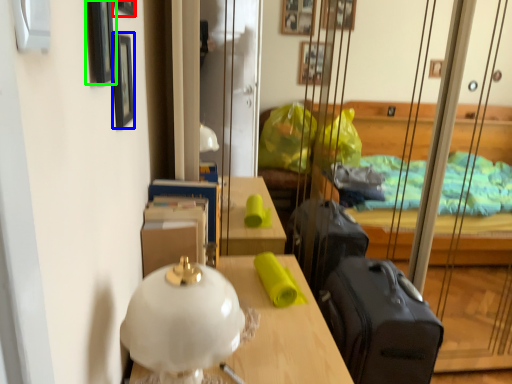
Question: Which object is positioned farthest from picture frame (highlighted by a red box)? Select from picture frame (highlighted by a blue box) and picture frame (highlighted by a green box).

Choices:
 (A) picture frame
 (B) picture frame

Answer: (B)